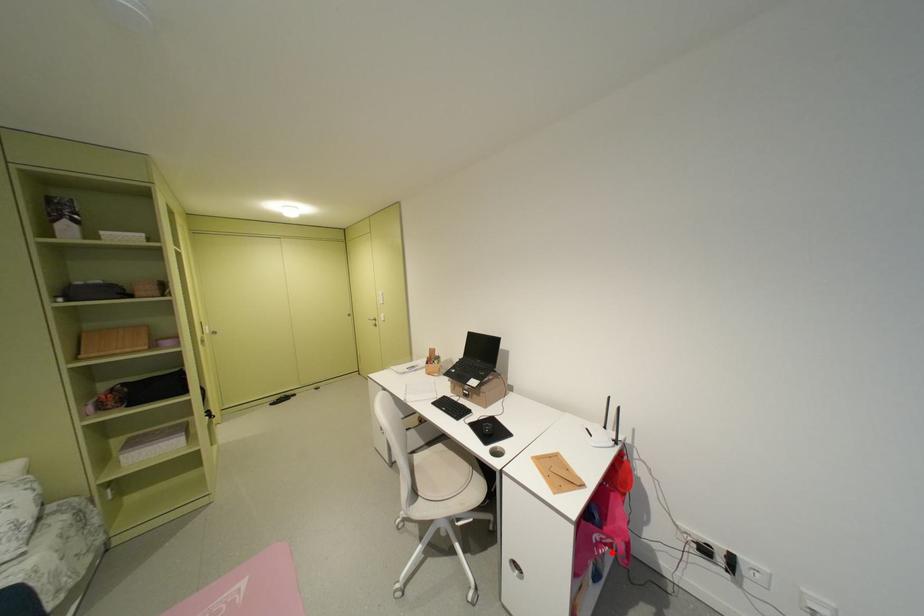
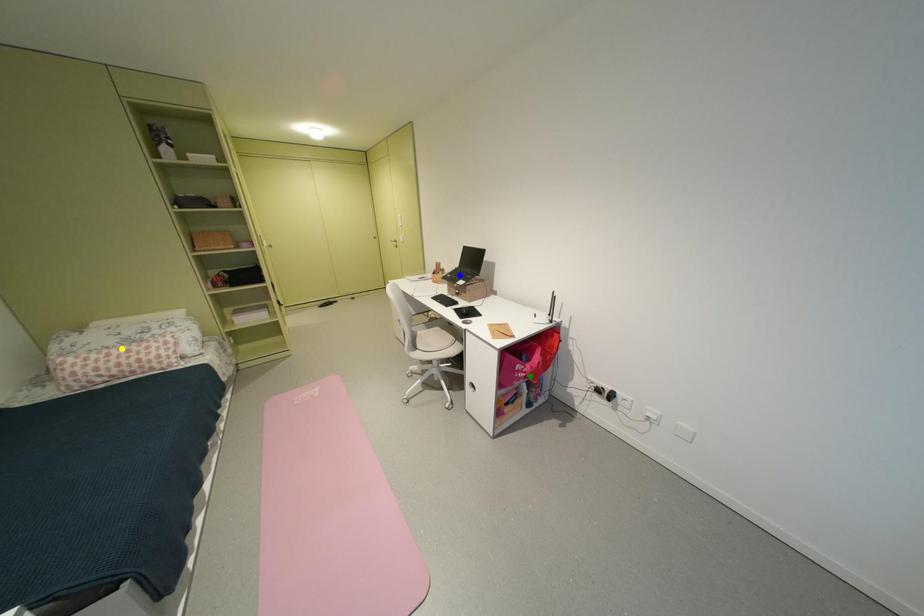
Question: I am providing you with two images of the same scene from different viewpoints. A red point is marked on the first image. You are given multiple points on the second image. Which point in image 2 represents the same 3d spot as the red point in image 1?

Choices:
 (A) yellow point
 (B) blue point
 (C) green point

Answer: (C)